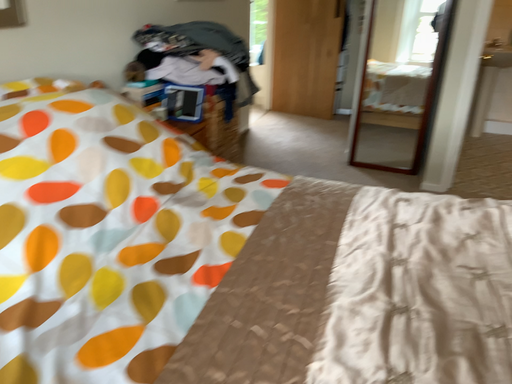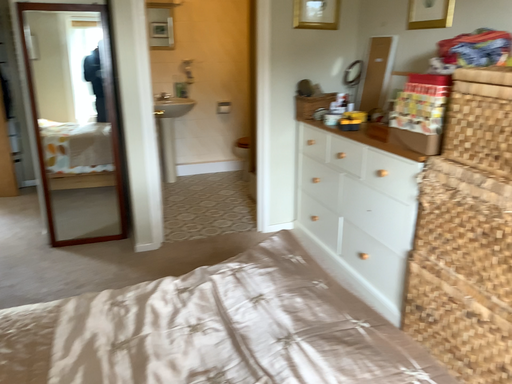
Question: Which way did the camera rotate in the video?

Choices:
 (A) rotated downward
 (B) rotated upward

Answer: (B)